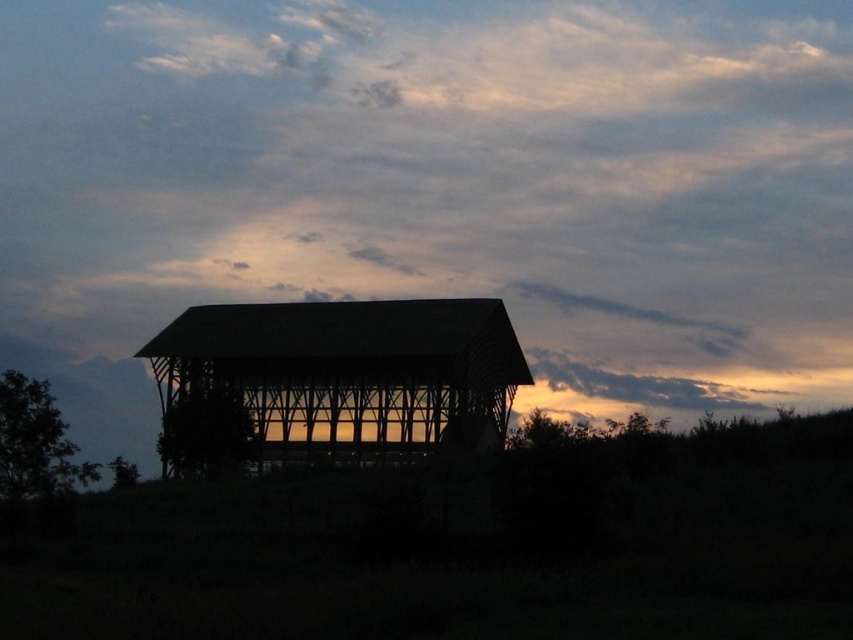
You are an architect analyzing the composition of the scene. Based on the silhouette wood barn at center and the cloudy sky at upper center, which object is positioned higher in the image?

The cloudy sky at upper center is located above the silhouette wood barn at center, so it is positioned higher in the image.

You are an artist trying to sketch this scene. You want to ensure the cloudy sky at upper center and the silhouette wood barn at center are positioned correctly in terms of depth. Which object should you draw first to establish the background?

The cloudy sky at upper center should be drawn first as it is further away from the viewer compared to the silhouette wood barn at center, making it part of the background.

You are an artist trying to paint the scene. You want to ensure the cloudy sky at upper center and the silhouette wood barn at center are proportionally accurate. Which object should you make larger in your painting?

The cloudy sky at upper center should be made larger than the silhouette wood barn at center in the painting since the cloudy sky at upper center is bigger than the silhouette wood barn at center according to the description.